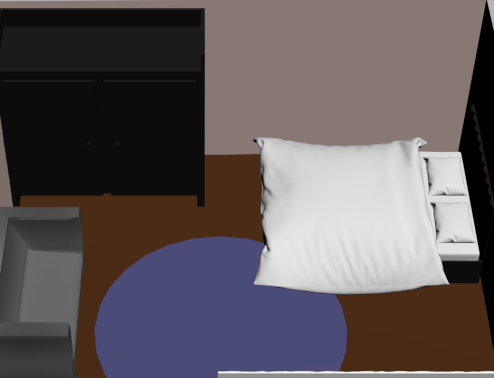
You are a GUI agent. You are given a task and a screenshot of the screen. Output one action in this format:
    pyautogui.click(x=<x>, y=<y>)
    Task: Click on the wall
    The width and height of the screenshot is (494, 378).
    Given the screenshot: What is the action you would take?
    pyautogui.click(x=271, y=40)